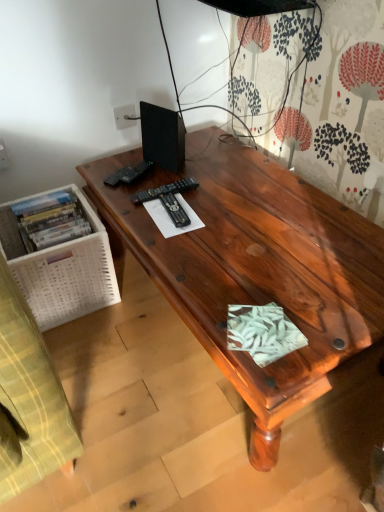
Question: Visually, is satin wood desk at center positioned to the left or to the right of black matte speaker at upper left?

Choices:
 (A) right
 (B) left

Answer: (A)

Question: From a real-world perspective, relative to black matte speaker at upper left, is satin wood desk at center vertically above or below?

Choices:
 (A) above
 (B) below

Answer: (B)

Question: Which object is positioned farthest from the black matte speaker at upper left?

Choices:
 (A) black plastic remote control at center, acting as the second remote control starting from the front
 (B) satin wood desk at center
 (C) black plastic remote control at upper left, marked as the third remote control in a front-to-back arrangement
 (D) black plastic remote control at center, the 3th remote control positioned from the back

Answer: (B)

Question: Which object is positioned closest to the black plastic remote control at center, the 3th remote control positioned from the back?

Choices:
 (A) black matte speaker at upper left
 (B) black plastic remote control at upper left, the first remote control in the back-to-front sequence
 (C) satin wood desk at center
 (D) black plastic remote control at center, the 2th remote control viewed from the back

Answer: (D)